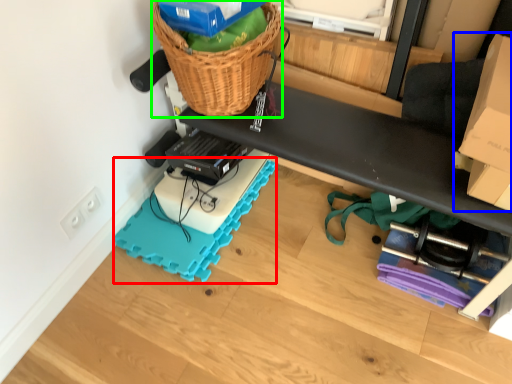
Question: Considering the real-world distances, which object is closest to yoga mat (highlighted by a red box)? cardboard box (highlighted by a blue box) or basket (highlighted by a green box).

Choices:
 (A) cardboard box
 (B) basket

Answer: (B)